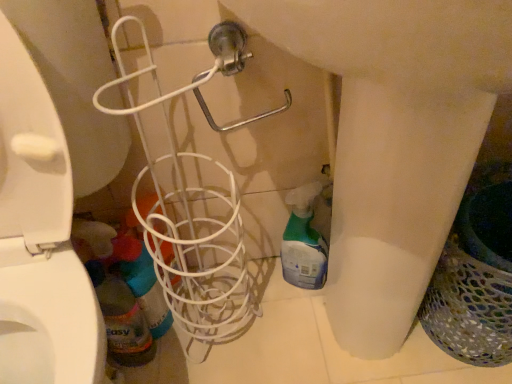
Question: In the image, is multicolored mesh laundry basket at right positioned in front of or behind translucent plastic spray bottle at lower left, the 1th cleaning product in the left-to-right sequence?

Choices:
 (A) behind
 (B) front

Answer: (B)

Question: Based on their sizes in the image, would you say multicolored mesh laundry basket at right is bigger or smaller than translucent plastic spray bottle at lower left, the 1th cleaning product in the left-to-right sequence?

Choices:
 (A) big
 (B) small

Answer: (A)

Question: Estimate the real-world distances between objects in this image. Which object is farther from the translucent plastic bottle at lower left?

Choices:
 (A) multicolored mesh laundry basket at right
 (B) translucent plastic spray bottle at lower center, arranged as the 2th cleaning product when viewed from the left
 (C) metallic silver shower at upper center
 (D) translucent plastic spray bottle at lower left, the 1th cleaning product in the left-to-right sequence
 (E) white wire basket at center

Answer: (A)

Question: Which object is positioned farthest from the translucent plastic spray bottle at lower center, arranged as the 2th cleaning product when viewed from the left?

Choices:
 (A) metallic silver shower at upper center
 (B) white wire basket at center
 (C) translucent plastic bottle at lower left
 (D) multicolored mesh laundry basket at right
 (E) translucent plastic spray bottle at lower left, the 2th cleaning product when ordered from right to left

Answer: (C)